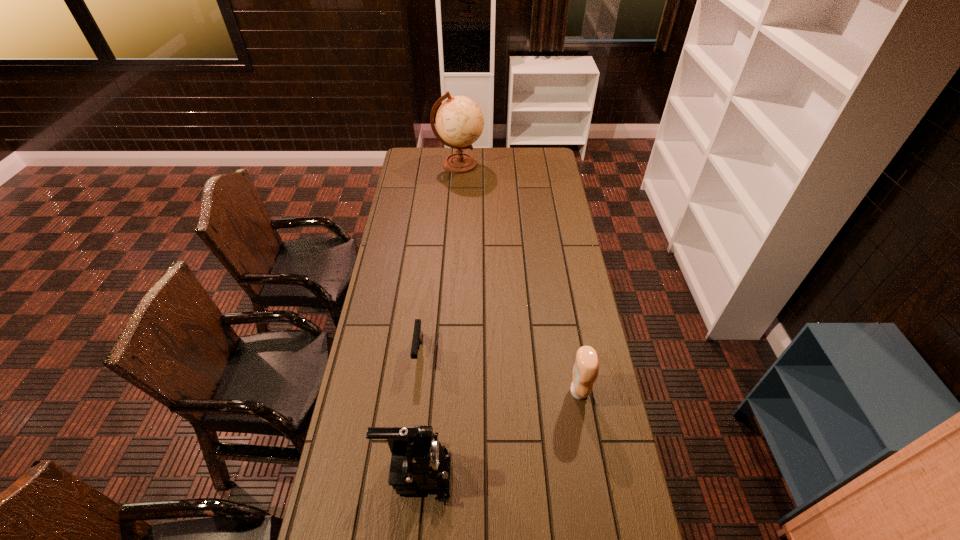
Locate an element on the screen. The height and width of the screenshot is (540, 960). vacant space at the far left corner of the desktop is located at coordinates (427, 166).

Locate an element on the screen. blank region between the pistol and the third shortest object is located at coordinates (418, 412).

You are a GUI agent. You are given a task and a screenshot of the screen. Output one action in this format:
    pyautogui.click(x=<x>, y=<y>)
    Task: Click on the free space between the third shortest object and the third nearest object
    This screenshot has height=540, width=960.
    Given the screenshot: What is the action you would take?
    418,412

The width and height of the screenshot is (960, 540). What are the coordinates of `vacant space that's between the tallest object and the third nearest object` in the screenshot? It's located at (439, 258).

Where is `free spot between the nearest object and the shortest object`? The image size is (960, 540). free spot between the nearest object and the shortest object is located at coordinates (418, 412).

You are a GUI agent. You are given a task and a screenshot of the screen. Output one action in this format:
    pyautogui.click(x=<x>, y=<y>)
    Task: Click on the free space between the farthest object and the pistol
    
    Given the screenshot: What is the action you would take?
    pyautogui.click(x=439, y=258)

Image resolution: width=960 pixels, height=540 pixels. In order to click on vacant area that lies between the nearest object and the shortest object in this screenshot , I will do `click(418, 412)`.

Locate an element on the screen. free point between the rightmost object and the farthest object is located at coordinates (518, 278).

At what (x,y) coordinates should I click in order to perform the action: click on empty location between the farthest object and the shortest object. Please return your answer as a coordinate pair (x, y). Looking at the image, I should click on (439, 258).

In order to click on free space between the camcorder and the condiment in this screenshot , I will do `click(497, 431)`.